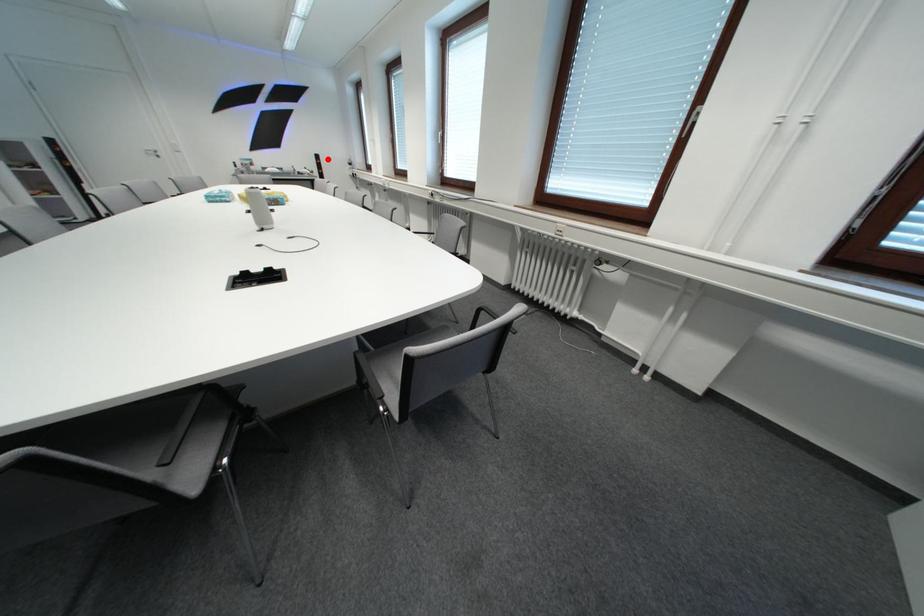
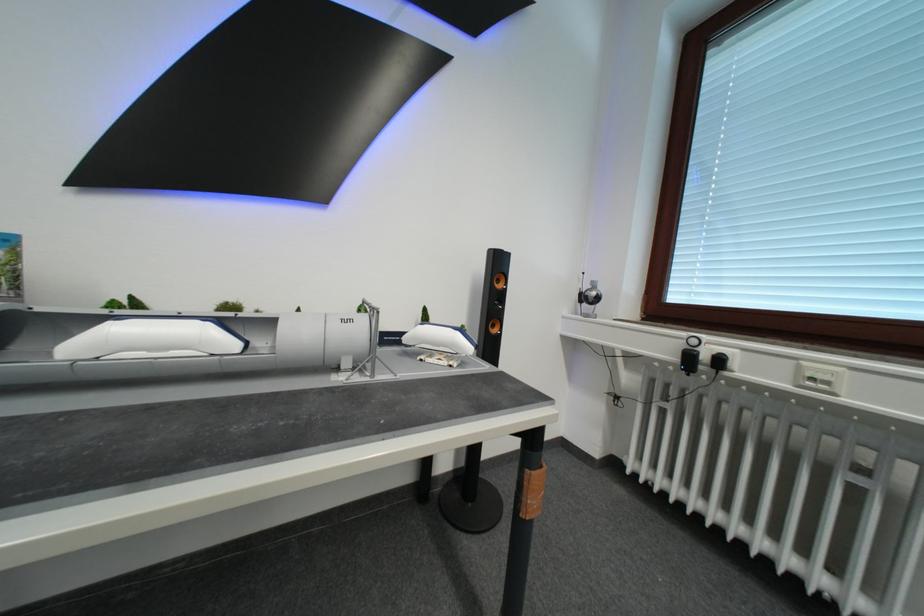
Question: A red point is marked in image1. In image2, is the corresponding 3D point closer to the camera or farther? Reply with the corresponding letter.

Choices:
 (A) The corresponding 3D point is closer.
 (B) The corresponding 3D point is farther.

Answer: (B)